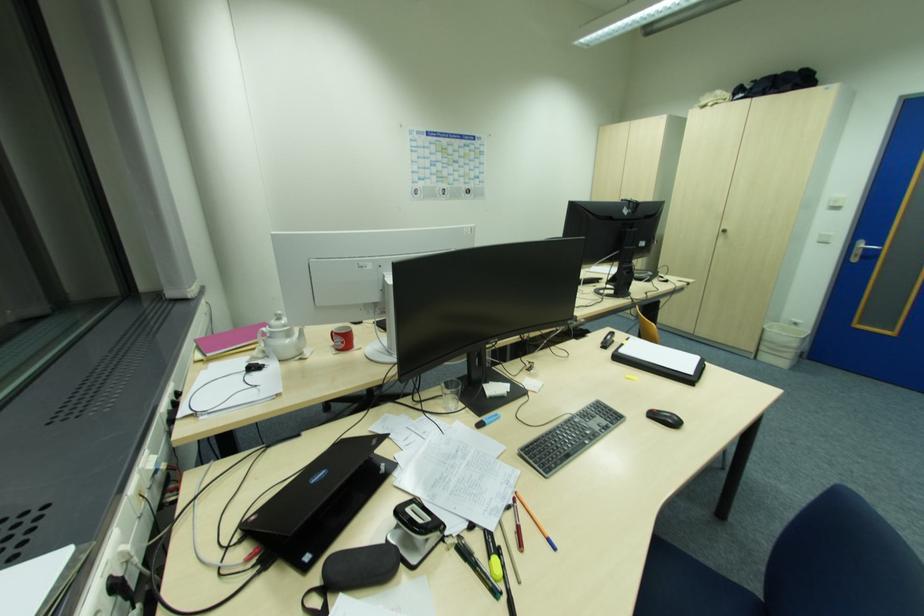
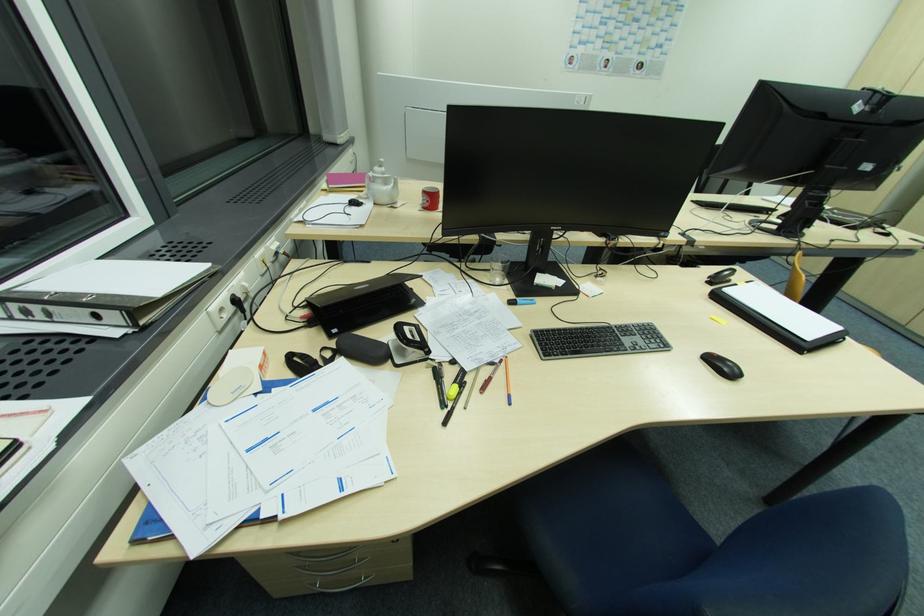
The point at (x=432, y=521) is marked in the first image. Where is the corresponding point in the second image?

(420, 341)